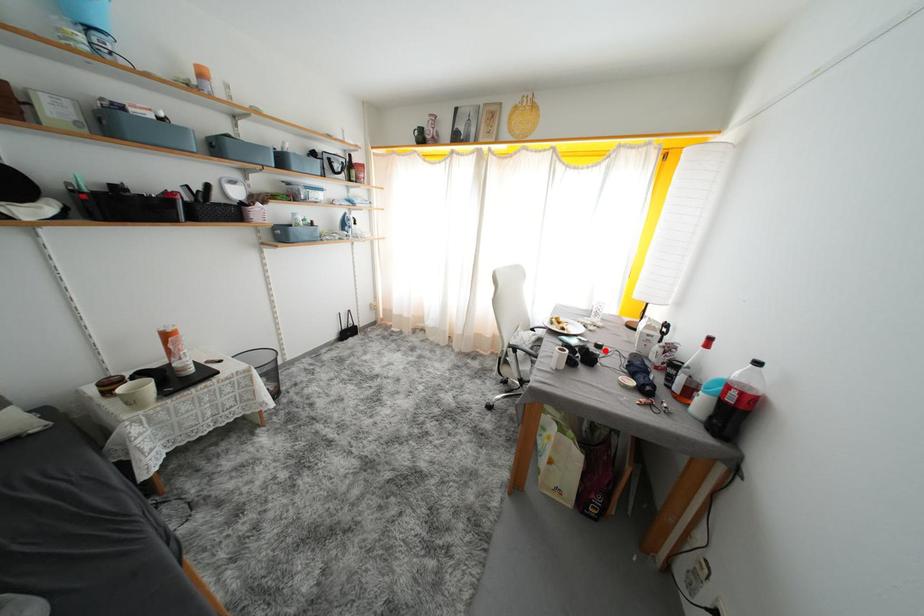
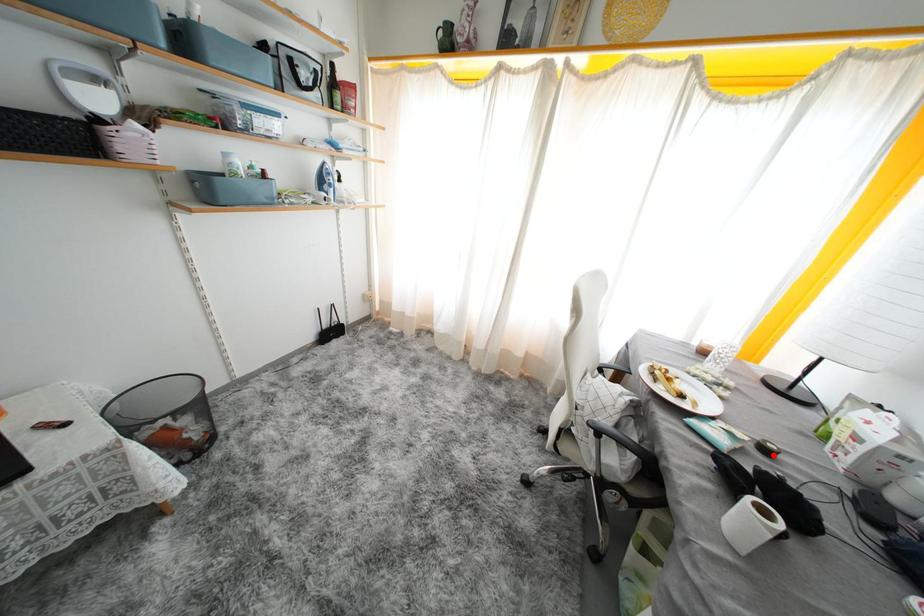
Based on the photo, I am providing you with two images of the same scene from different viewpoints. A red point is marked on the first image and another point is marked on the second image. Is the marked point in image1 the same physical position as the marked point in image2?

Yes